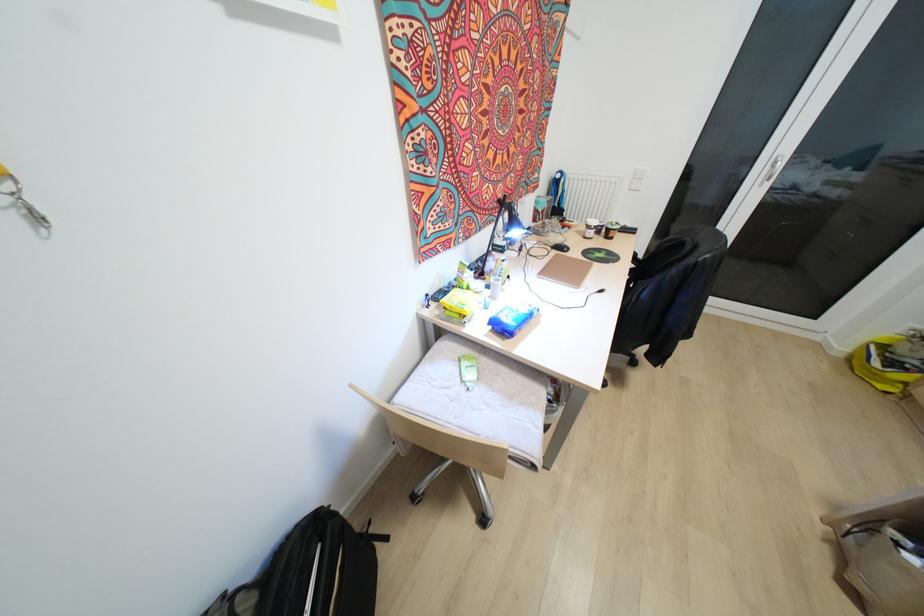
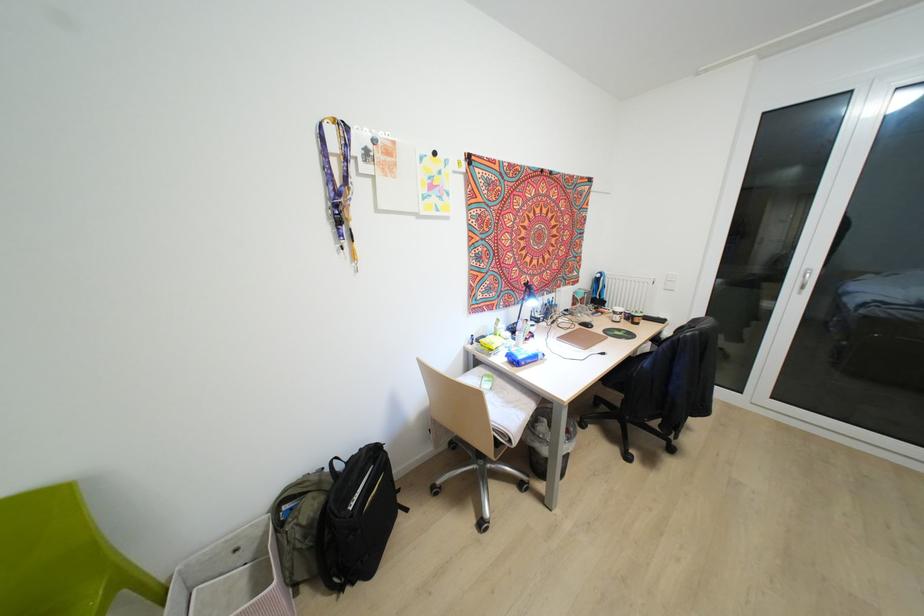
Where in the second image is the point corresponding to point (501, 249) from the first image?

(536, 320)